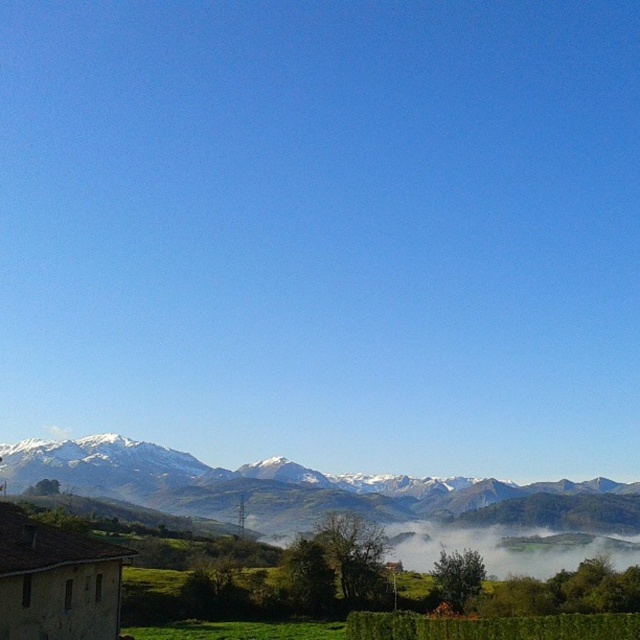
Who is taller, snowy rocky mountain range at upper center or white misty fog at lower center?

Standing taller between the two is snowy rocky mountain range at upper center.

Between snowy rocky mountain range at upper center and white misty fog at lower center, which one appears on the left side from the viewer's perspective?

snowy rocky mountain range at upper center is more to the left.

Which is behind, point (257, 502) or point (516, 541)?

The point (257, 502) is more distant.

The width and height of the screenshot is (640, 640). Identify the location of snowy rocky mountain range at upper center. (264, 484).